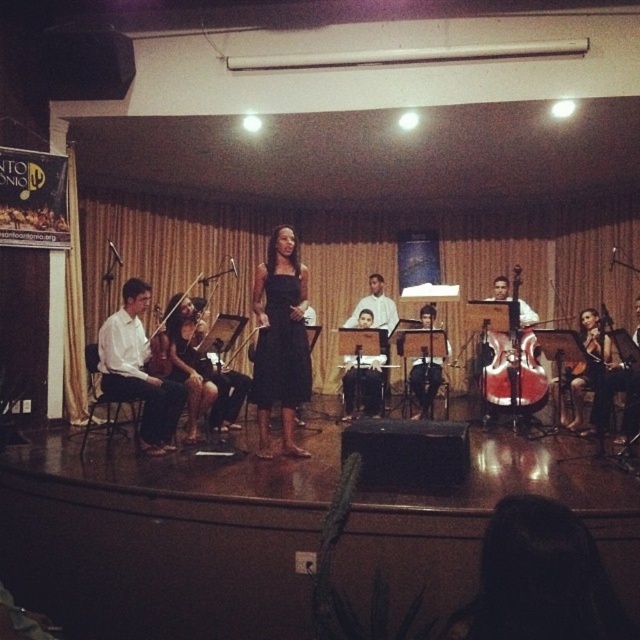
You are a photographer taking a picture of the stage. You notice the white smooth shirt at left and the red glossy cello at center right. Which object should you focus on if you want to capture the larger one in your shot?

The red glossy cello at center right is larger than the white smooth shirt at left, so you should focus on the red glossy cello at center right to capture the larger one.

You are a photographer taking pictures from the audience. You want to capture both the black satin dress at center and the shiny brown violin at right in the same frame. Which object should you focus on first to ensure both are in focus?

The black satin dress at center is in front of the shiny brown violin at right. To ensure both are in focus, you should focus on the black satin dress at center first since it is closer to the camera.